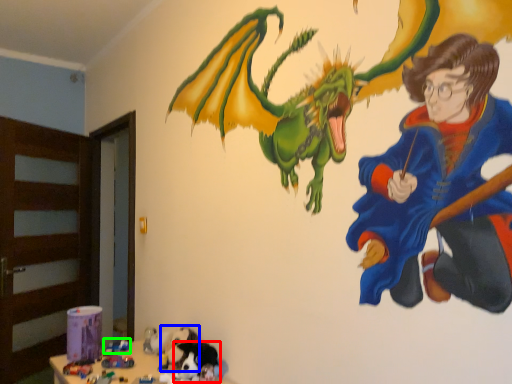
Question: Which object is the farthest from animal (highlighted by a red box)? Choose among these: animal (highlighted by a blue box) or toy (highlighted by a green box).

Choices:
 (A) animal
 (B) toy

Answer: (B)